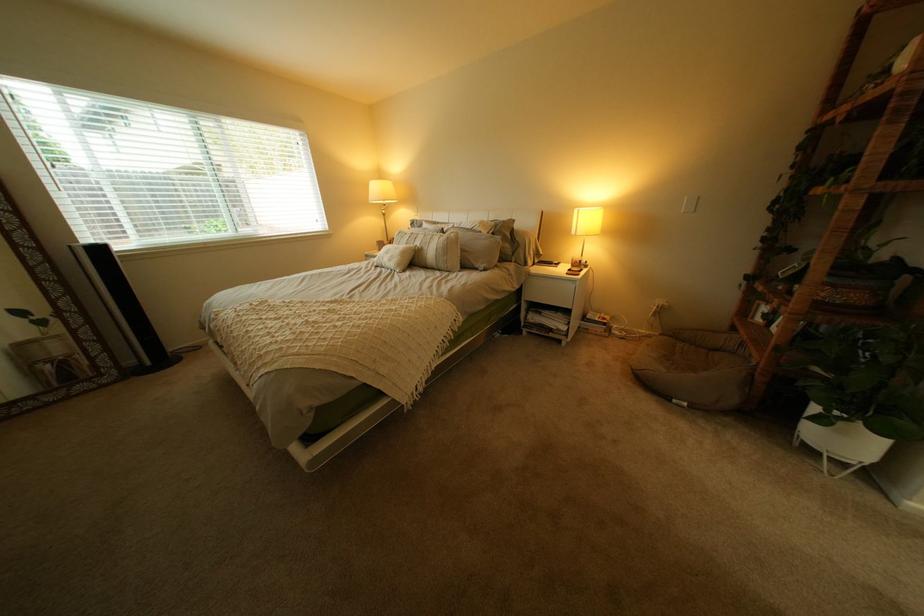
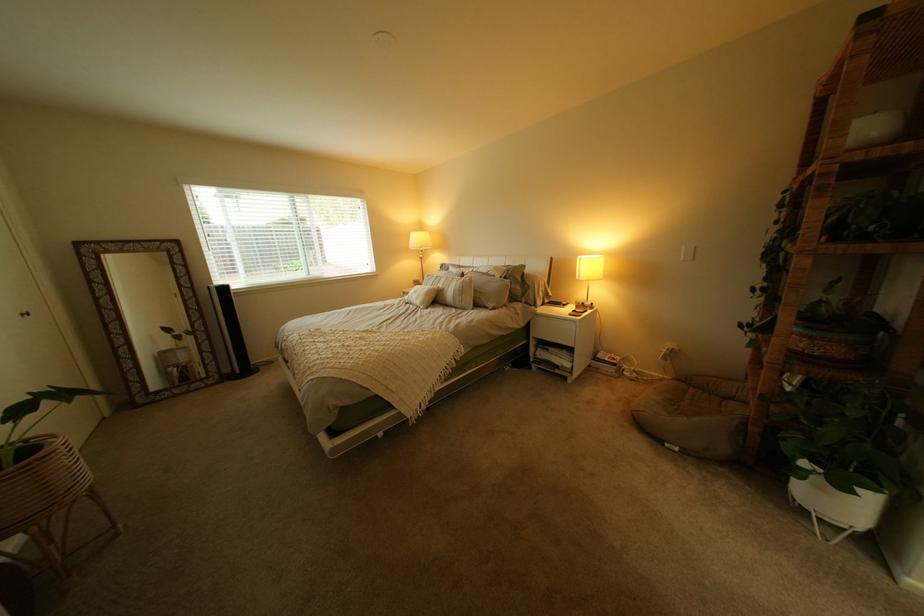
In the second image, find the point that corresponds to (x=403, y=253) in the first image.

(431, 293)